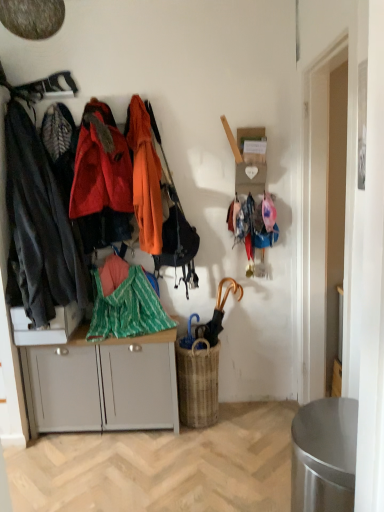
Question: Is woven brown picnic basket at center further to camera compared to orange fabric coat at center, the third clothing in the left-to-right sequence?

Choices:
 (A) no
 (B) yes

Answer: (B)

Question: Considering the relative sizes of woven brown picnic basket at center and orange fabric coat at center, which appears as the 1th clothing when viewed from the right, in the image provided, is woven brown picnic basket at center shorter than orange fabric coat at center, which appears as the 1th clothing when viewed from the right,?

Choices:
 (A) yes
 (B) no

Answer: (A)

Question: Is woven brown picnic basket at center oriented away from orange fabric coat at center, which appears as the 1th clothing when viewed from the right?

Choices:
 (A) no
 (B) yes

Answer: (A)

Question: Is woven brown picnic basket at center placed right next to orange fabric coat at center, the third clothing in the left-to-right sequence?

Choices:
 (A) yes
 (B) no

Answer: (B)

Question: Considering the relative positions of woven brown picnic basket at center and orange fabric coat at center, which appears as the 1th clothing when viewed from the right, in the image provided, is woven brown picnic basket at center in front of orange fabric coat at center, which appears as the 1th clothing when viewed from the right,?

Choices:
 (A) yes
 (B) no

Answer: (B)

Question: From a real-world perspective, does woven brown picnic basket at center sit lower than orange fabric coat at center, which appears as the 1th clothing when viewed from the right?

Choices:
 (A) yes
 (B) no

Answer: (A)

Question: Would you say orange matte jacket at left, which appears as the 2th clothing when viewed from the left, contains leather handbag at center?

Choices:
 (A) no
 (B) yes

Answer: (A)

Question: Is orange matte jacket at left, the 2th clothing when ordered from right to left, thinner than leather handbag at center?

Choices:
 (A) yes
 (B) no

Answer: (B)

Question: Could you tell me if orange matte jacket at left, the 2th clothing when ordered from right to left, is turned towards leather handbag at center?

Choices:
 (A) yes
 (B) no

Answer: (B)

Question: Is orange matte jacket at left, which appears as the 2th clothing when viewed from the left, taller than leather handbag at center?

Choices:
 (A) yes
 (B) no

Answer: (B)

Question: Can you confirm if orange matte jacket at left, which appears as the 2th clothing when viewed from the left, is wider than leather handbag at center?

Choices:
 (A) no
 (B) yes

Answer: (B)

Question: Does orange matte jacket at left, which appears as the 2th clothing when viewed from the left, appear on the left side of leather handbag at center?

Choices:
 (A) no
 (B) yes

Answer: (B)

Question: Is gold metallic umbrella at center-right to the right of orange matte jacket at left, which appears as the 2th clothing when viewed from the left, from the viewer's perspective?

Choices:
 (A) yes
 (B) no

Answer: (A)